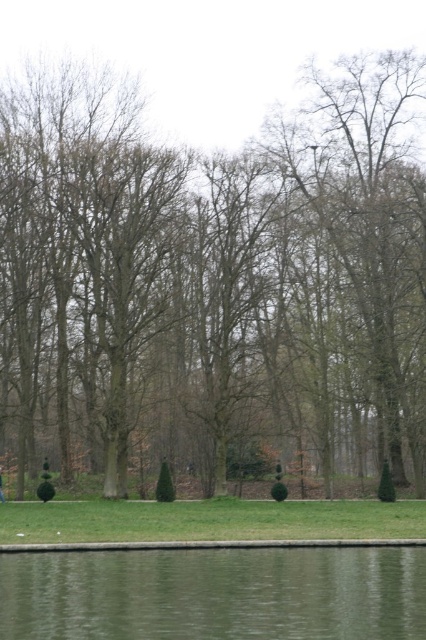
Based on the photo, can you confirm if brown textured tree at center is bigger than green fabric person at lower center?

Correct, brown textured tree at center is larger in size than green fabric person at lower center.

Who is more forward, (x=226, y=205) or (x=2, y=484)?

Point (x=2, y=484) is in front.

This screenshot has width=426, height=640. What are the coordinates of `brown textured tree at center` in the screenshot? It's located at (213, 284).

Does green reflective water at lower center have a greater height compared to green fabric person at lower center?

Correct, green reflective water at lower center is much taller as green fabric person at lower center.

Which of these two, green reflective water at lower center or green fabric person at lower center, stands shorter?

Standing shorter between the two is green fabric person at lower center.

At what (x,y) coordinates should I click in order to perform the action: click on green reflective water at lower center. Please return your answer as a coordinate pair (x, y). Looking at the image, I should click on (215, 595).

How distant is brown textured tree at center from green reflective water at lower center?

brown textured tree at center and green reflective water at lower center are 19.04 meters apart from each other.

Is brown textured tree at center above green reflective water at lower center?

Yes.

Describe the element at coordinates (213, 284) in the screenshot. I see `brown textured tree at center` at that location.

This screenshot has height=640, width=426. What are the coordinates of `brown textured tree at center` in the screenshot? It's located at (213, 284).